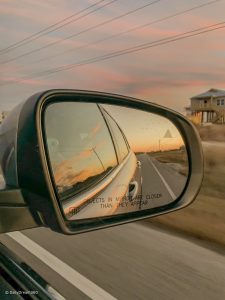
Locate an element on the screen. handle is located at coordinates (135, 186).